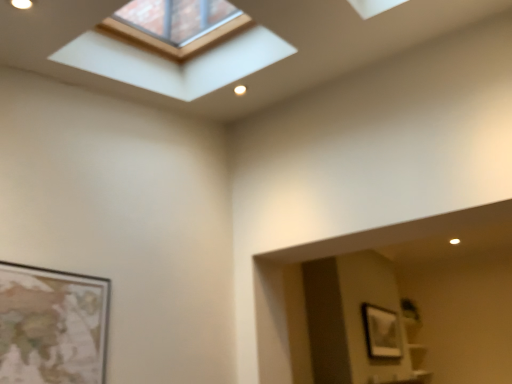
Describe the element at coordinates (381, 332) in the screenshot. This screenshot has height=384, width=512. I see `matte silver picture frame at upper right` at that location.

Find the location of a particular element. This screenshot has width=512, height=384. matte silver picture frame at upper right is located at coordinates 381,332.

What do you see at coordinates (174, 63) in the screenshot? This screenshot has height=384, width=512. I see `clear glass window at upper center` at bounding box center [174, 63].

What is the approximate width of clear glass window at upper center?

It is 29.04 inches.

In order to face clear glass window at upper center, should I rotate leftwards or rightwards?

Rotate your view left by about 9.234°.

Identify the location of clear glass window at upper center. The width and height of the screenshot is (512, 384). (174, 63).

Find the location of `matte silver picture frame at upper right`. matte silver picture frame at upper right is located at coordinates (381, 332).

In the image, is clear glass window at upper center on the left side or the right side of matte silver picture frame at upper right?

From the image, it's evident that clear glass window at upper center is to the left of matte silver picture frame at upper right.

Who is more distant, clear glass window at upper center or matte silver picture frame at upper right?

matte silver picture frame at upper right is more distant.

Which point is more forward, (283, 50) or (386, 339)?

The point (283, 50) is in front.

From the image's perspective, is clear glass window at upper center located beneath matte silver picture frame at upper right?

No.

From a real-world perspective, is clear glass window at upper center above or below matte silver picture frame at upper right?

From a real-world perspective, clear glass window at upper center is physically above matte silver picture frame at upper right.

In terms of width, does clear glass window at upper center look wider or thinner when compared to matte silver picture frame at upper right?

Clearly, clear glass window at upper center has more width compared to matte silver picture frame at upper right.

Considering the sizes of clear glass window at upper center and matte silver picture frame at upper right in the image, is clear glass window at upper center taller or shorter than matte silver picture frame at upper right?

In the image, clear glass window at upper center appears to be taller than matte silver picture frame at upper right.

Between clear glass window at upper center and matte silver picture frame at upper right, which one has smaller size?

matte silver picture frame at upper right is smaller.

Could matte silver picture frame at upper right be considered to be inside clear glass window at upper center?

Actually, matte silver picture frame at upper right is outside clear glass window at upper center.

Is clear glass window at upper center far from matte silver picture frame at upper right?

Absolutely, clear glass window at upper center is distant from matte silver picture frame at upper right.

Is clear glass window at upper center turned away from matte silver picture frame at upper right?

No, clear glass window at upper center is not facing away from matte silver picture frame at upper right.

Can you tell me how much clear glass window at upper center and matte silver picture frame at upper right differ in facing direction?

clear glass window at upper center and matte silver picture frame at upper right are facing 90.2 degrees away from each other.

Where is `window located above the matte silver picture frame at upper right (from a real-world perspective)`? This screenshot has height=384, width=512. window located above the matte silver picture frame at upper right (from a real-world perspective) is located at coordinates (174, 63).

Looking at this image, which is more to the right, matte silver picture frame at upper right or clear glass window at upper center?

matte silver picture frame at upper right.

Relative to clear glass window at upper center, is matte silver picture frame at upper right in front or behind?

Clearly, matte silver picture frame at upper right is behind clear glass window at upper center.

Is point (376, 335) closer to camera compared to point (135, 67)?

No, (376, 335) is behind (135, 67).

From the image's perspective, does matte silver picture frame at upper right appear lower than clear glass window at upper center?

Yes, from the image's perspective, matte silver picture frame at upper right is below clear glass window at upper center.

From a real-world perspective, who is located lower, matte silver picture frame at upper right or clear glass window at upper center?

In real-world perspective, matte silver picture frame at upper right is lower.

Considering the sizes of objects matte silver picture frame at upper right and clear glass window at upper center in the image provided, who is wider, matte silver picture frame at upper right or clear glass window at upper center?

clear glass window at upper center.

Considering the sizes of objects matte silver picture frame at upper right and clear glass window at upper center in the image provided, who is taller, matte silver picture frame at upper right or clear glass window at upper center?

clear glass window at upper center.

Who is smaller, matte silver picture frame at upper right or clear glass window at upper center?

Smaller between the two is matte silver picture frame at upper right.

Is matte silver picture frame at upper right inside the boundaries of clear glass window at upper center, or outside?

matte silver picture frame at upper right is located beyond the bounds of clear glass window at upper center.

Can you see matte silver picture frame at upper right touching clear glass window at upper center?

They are not placed beside each other.

Is matte silver picture frame at upper right oriented away from clear glass window at upper center?

No, clear glass window at upper center is not at the back of matte silver picture frame at upper right.

How many degrees apart are the facing directions of matte silver picture frame at upper right and clear glass window at upper center?

There is a 90.2-degree angle between the facing directions of matte silver picture frame at upper right and clear glass window at upper center.

Identify the location of window positioned vertically above the matte silver picture frame at upper right (from a real-world perspective). This screenshot has width=512, height=384. (174, 63).

This screenshot has width=512, height=384. I want to click on window above the matte silver picture frame at upper right (from the image's perspective), so click(174, 63).

Locate an element on the screen. This screenshot has height=384, width=512. window located above the matte silver picture frame at upper right (from a real-world perspective) is located at coordinates (x=174, y=63).